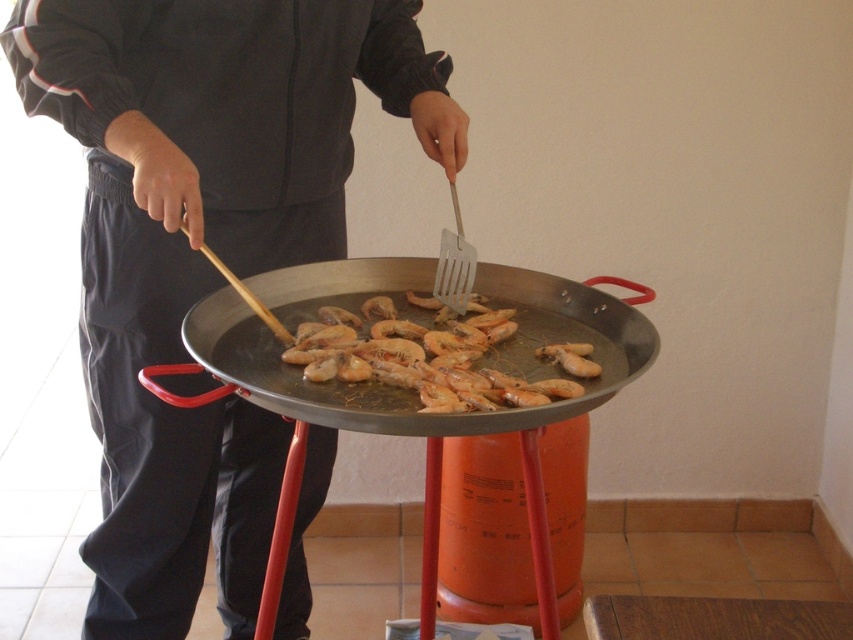
Who is lower down, dark gray fabric jacket at center or shiny golden shrimp at center?

Positioned lower is dark gray fabric jacket at center.

Does dark gray fabric jacket at center have a larger size compared to shiny golden shrimp at center?

Yes.

Locate an element on the screen. dark gray fabric jacket at center is located at coordinates point(207,243).

Does dark gray fabric jacket at center come behind translucent orange shrimp at center?

That is False.

Does dark gray fabric jacket at center appear on the right side of translucent orange shrimp at center?

In fact, dark gray fabric jacket at center is to the left of translucent orange shrimp at center.

The width and height of the screenshot is (853, 640). I want to click on dark gray fabric jacket at center, so click(x=207, y=243).

Find the location of a particular element. The image size is (853, 640). dark gray fabric jacket at center is located at coordinates (207, 243).

The image size is (853, 640). Describe the element at coordinates (405, 289) in the screenshot. I see `shiny metal wok at center` at that location.

Does point (409, 276) come in front of point (573, 362)?

No, (409, 276) is behind (573, 362).

What are the coordinates of `shiny metal wok at center` in the screenshot? It's located at (405, 289).